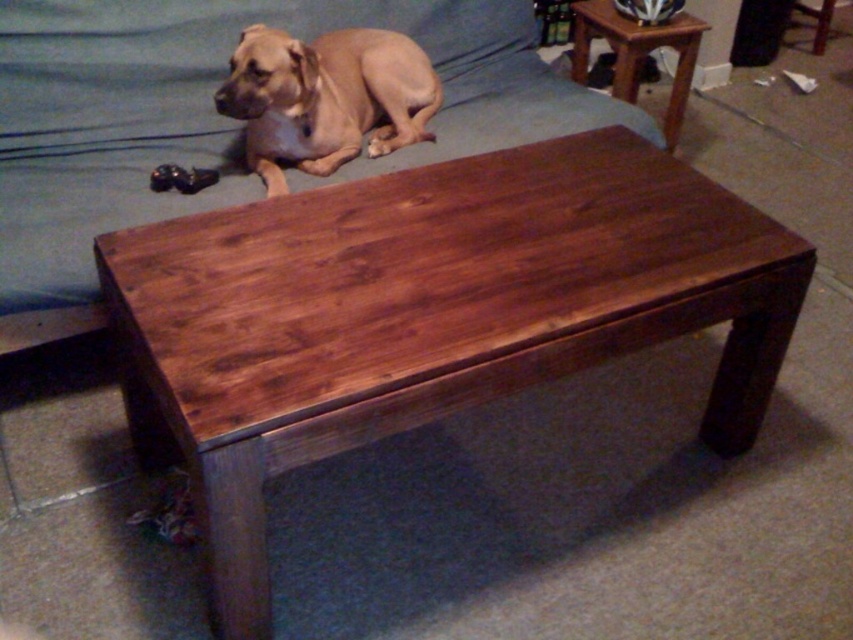
You are arranging a small plant on the dark brown wood table at center and the mahogany wood side table at upper right. Which table should you place it on if you want the plant to be closer to the sofa?

The dark brown wood table at center is to the left of the mahogany wood side table at upper right. Since the sofa is in the background, placing the plant on the dark brown wood table at center would position it closer to the sofa.